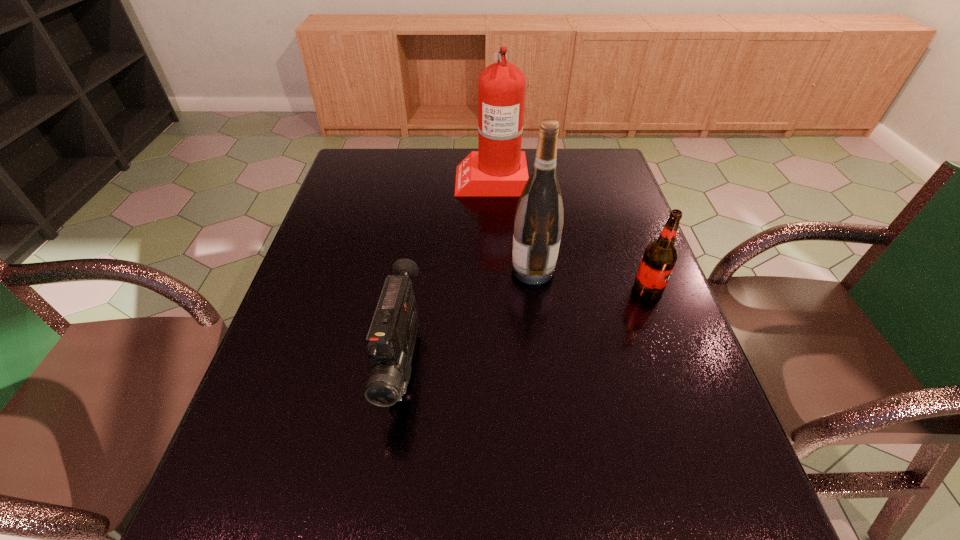
Locate an element on the screen. free area in between the wine bottle and the root beer is located at coordinates (590, 280).

The height and width of the screenshot is (540, 960). Identify the location of vacant point located between the nearest object and the fire extinguisher. (446, 272).

Identify the location of object that ranks as the second closest to the farthest object. The image size is (960, 540). (659, 259).

Identify which object is located as the second nearest to the wine bottle. Please provide its 2D coordinates. Your answer should be formatted as a tuple, i.e. [(x, y)], where the tuple contains the x and y coordinates of a point satisfying the conditions above.

[(390, 341)]

Locate an element on the screen. free space in the image that satisfies the following two spatial constraints: 1. on the front-facing side of the fire extinguisher; 2. on the front-facing side of the nearest object is located at coordinates (496, 364).

Locate an element on the screen. The width and height of the screenshot is (960, 540). blank area in the image that satisfies the following two spatial constraints: 1. on the front-facing side of the fire extinguisher; 2. on the front-facing side of the shortest object is located at coordinates (496, 364).

Identify the location of vacant area in the image that satisfies the following two spatial constraints: 1. on the front-facing side of the rightmost object; 2. on the left side of the fire extinguisher. The image size is (960, 540). (494, 289).

This screenshot has height=540, width=960. I want to click on free location that satisfies the following two spatial constraints: 1. on the label of the wine bottle; 2. on the back side of the third tallest object, so click(536, 289).

The image size is (960, 540). Identify the location of free space that satisfies the following two spatial constraints: 1. on the front-facing side of the fire extinguisher; 2. on the front-facing side of the leftmost object. (496, 364).

Find the location of a particular element. free spot that satisfies the following two spatial constraints: 1. on the back side of the second shortest object; 2. on the front-facing side of the fire extinguisher is located at coordinates (607, 179).